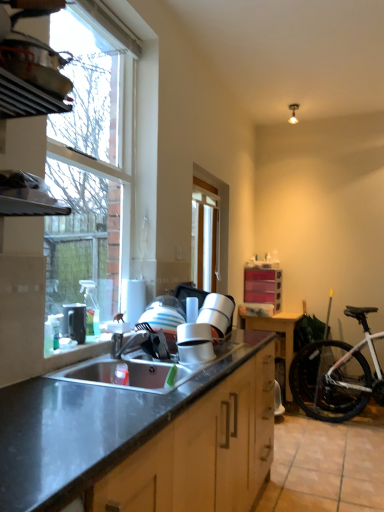
Looking at this image, measure the distance between matte black kettle at left and camera.

5.66 feet.

Looking at this image, measure the distance between brushed metal faucet at sink and camera.

They are 1.88 meters apart.

In order to face dark gray granite countertop at center, should I rotate leftwards or rightwards?

To face it directly, rotate left by 3.017 degrees.

Measure the distance between clear glass window at center, marked as the first window in a back-to-front arrangement, and camera.

clear glass window at center, marked as the first window in a back-to-front arrangement, is 9.84 feet from camera.

This screenshot has height=512, width=384. Identify the location of matte black kettle at left. (74, 322).

What's the angular difference between brushed metal faucet at sink and white matte bicycle at lower right's facing directions?

The angular difference between brushed metal faucet at sink and white matte bicycle at lower right is 61.6 degrees.

Which is closer, (130, 339) or (367, 327)?

The point (130, 339) is closer to the camera.

From the image's perspective, between brushed metal faucet at sink and white matte bicycle at lower right, which one is located above?

From the image's view, brushed metal faucet at sink is above.

Is brushed metal faucet at sink inside the boundaries of white matte bicycle at lower right, or outside?

brushed metal faucet at sink exists outside the volume of white matte bicycle at lower right.

Is matte black kettle at left bigger than dark gray granite countertop at center?

No.

Which is correct: matte black kettle at left is inside dark gray granite countertop at center, or outside of it?

matte black kettle at left is spatially situated outside dark gray granite countertop at center.

From the picture: Which object is thinner, matte black kettle at left or dark gray granite countertop at center?

Thinner between the two is matte black kettle at left.

Which object is positioned more to the left, dark gray granite countertop at center or white matte bicycle at lower right?

dark gray granite countertop at center is more to the left.

From the image's perspective, between dark gray granite countertop at center and white matte bicycle at lower right, who is located below?

dark gray granite countertop at center appears lower in the image.

Can you confirm if dark gray granite countertop at center is thinner than white matte bicycle at lower right?

No.

Is white matte bicycle at lower right at the back of dark gray granite countertop at center?

No, dark gray granite countertop at center is not facing away from white matte bicycle at lower right.

In order to click on appliance above the wooden table at right (from a real-world perspective) in this screenshot , I will do `click(74, 322)`.

Who is shorter, wooden table at right or matte black kettle at left?

matte black kettle at left.

How different are the orientations of wooden table at right and matte black kettle at left in degrees?

The facing directions of wooden table at right and matte black kettle at left are 90.9 degrees apart.

Does white matte bicycle at lower right come in front of clear glass window at upper left, which is the first window from left to right?

No, it is behind clear glass window at upper left, which is the first window from left to right.

Is white matte bicycle at lower right turned away from clear glass window at upper left, which is the 2th window in right-to-left order?

No, white matte bicycle at lower right's orientation is not away from clear glass window at upper left, which is the 2th window in right-to-left order.

Do you think white matte bicycle at lower right is within clear glass window at upper left, which is the 2th window in right-to-left order, or outside of it?

white matte bicycle at lower right is not inside clear glass window at upper left, which is the 2th window in right-to-left order, it's outside.

Which object is thinner, white matte bicycle at lower right or clear glass window at upper left, the 1th window in the front-to-back sequence?

clear glass window at upper left, the 1th window in the front-to-back sequence.

Considering the points (122, 350) and (35, 490), which point is behind, point (122, 350) or point (35, 490)?

Point (122, 350)

This screenshot has width=384, height=512. Find the location of `faucet located above the dark gray granite countertop at center (from a real-world perspective)`. faucet located above the dark gray granite countertop at center (from a real-world perspective) is located at coordinates (132, 342).

Can you confirm if brushed metal faucet at sink is shorter than dark gray granite countertop at center?

Yes.

Which of these two, brushed metal faucet at sink or dark gray granite countertop at center, is thinner?

Thinner between the two is brushed metal faucet at sink.

Considering the sizes of clear glass window at upper left, the second window viewed from the back, and dark gray granite countertop at center in the image, is clear glass window at upper left, the second window viewed from the back, taller or shorter than dark gray granite countertop at center?

In the image, clear glass window at upper left, the second window viewed from the back, appears to be taller than dark gray granite countertop at center.

Is clear glass window at upper left, which is the 2th window in right-to-left order, oriented away from dark gray granite countertop at center?

No, dark gray granite countertop at center is not at the back of clear glass window at upper left, which is the 2th window in right-to-left order.

Is clear glass window at upper left, the second window viewed from the back, behind dark gray granite countertop at center?

Yes.

Between clear glass window at upper left, the second window viewed from the back, and dark gray granite countertop at center, which one has larger width?

Wider between the two is dark gray granite countertop at center.

You are a GUI agent. You are given a task and a screenshot of the screen. Output one action in this format:
    pyautogui.click(x=<x>, y=<y>)
    Task: Click on the bicycle below the brushed metal faucet at sink (from the image's perspective)
    
    Given the screenshot: What is the action you would take?
    pyautogui.click(x=337, y=375)

I want to click on countertop in front of the matte black kettle at left, so click(x=143, y=439).

Based on their spatial positions, is white matte bicycle at lower right or brushed metal faucet at sink closer to stainless steel sink at lower center?

Based on the image, brushed metal faucet at sink appears to be nearer to stainless steel sink at lower center.

Looking at the image, which one is located closer to brushed metal faucet at sink, clear glass window at center, acting as the 2th window starting from the front, or stainless steel sink at lower center?

Based on the image, stainless steel sink at lower center appears to be nearer to brushed metal faucet at sink.

When comparing their distances from brushed metal faucet at sink, does wooden table at right or clear glass window at upper left, which is the 2th window in right-to-left order, seem closer?

clear glass window at upper left, which is the 2th window in right-to-left order.

Which object lies further to the anchor point clear glass window at center, which is the 1th window from right to left, matte black kettle at left or white matte bicycle at lower right?

The object further to clear glass window at center, which is the 1th window from right to left, is matte black kettle at left.

Considering their positions, is stainless steel sink at lower center positioned further to brushed metal faucet at sink than white matte bicycle at lower right?

white matte bicycle at lower right is further to brushed metal faucet at sink.

Which object lies nearer to the anchor point stainless steel sink at lower center, clear glass window at center, which is the 1th window from right to left, or dark gray granite countertop at center?

dark gray granite countertop at center lies closer to stainless steel sink at lower center than the other object.

Looking at this image, based on their spatial positions, is matte black kettle at left or wooden table at right further from dark gray granite countertop at center?

wooden table at right is further to dark gray granite countertop at center.

From the image, which object appears to be farther from wooden table at right, dark gray granite countertop at center or clear glass window at center, acting as the 2th window starting from the front?

The object further to wooden table at right is dark gray granite countertop at center.

Identify the location of window located between matte black kettle at left and wooden table at right in the depth direction. (220, 221).

Where is `bicycle between dark gray granite countertop at center and wooden table at right from front to back`? The height and width of the screenshot is (512, 384). bicycle between dark gray granite countertop at center and wooden table at right from front to back is located at coordinates (337, 375).

Find the location of a particular element. faucet located between dark gray granite countertop at center and wooden table at right in the depth direction is located at coordinates (132, 342).

This screenshot has height=512, width=384. I want to click on faucet between stainless steel sink at lower center and wooden table at right from front to back, so click(x=132, y=342).